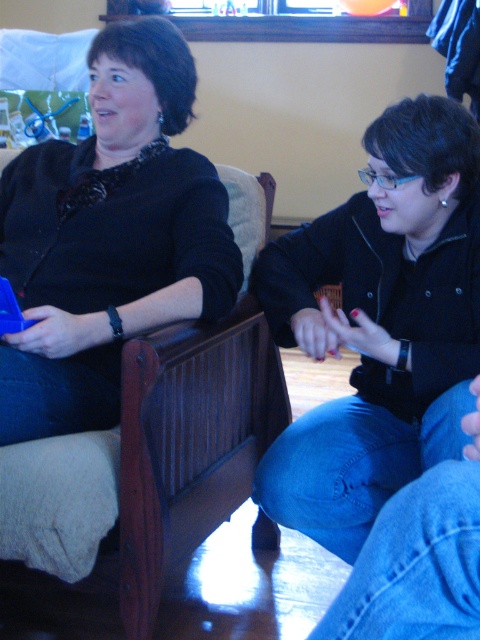
Question: Does black matte jacket at lower right appear on the left side of brown wood armchair at left?

Choices:
 (A) yes
 (B) no

Answer: (B)

Question: Is the position of black matte sweater at upper left less distant than that of brown wood armchair at left?

Choices:
 (A) no
 (B) yes

Answer: (A)

Question: Does black matte jacket at lower right appear over black matte sweater at upper left?

Choices:
 (A) no
 (B) yes

Answer: (A)

Question: Which point is farther to the camera?

Choices:
 (A) pos(183,198)
 (B) pos(432,365)

Answer: (A)

Question: Considering the real-world distances, which object is closest to the black matte sweater at upper left?

Choices:
 (A) black matte jacket at lower right
 (B) brown wood armchair at left

Answer: (B)

Question: Among these points, which one is nearest to the camera?

Choices:
 (A) (411, 218)
 (B) (45, 259)
 (C) (273, 346)

Answer: (A)